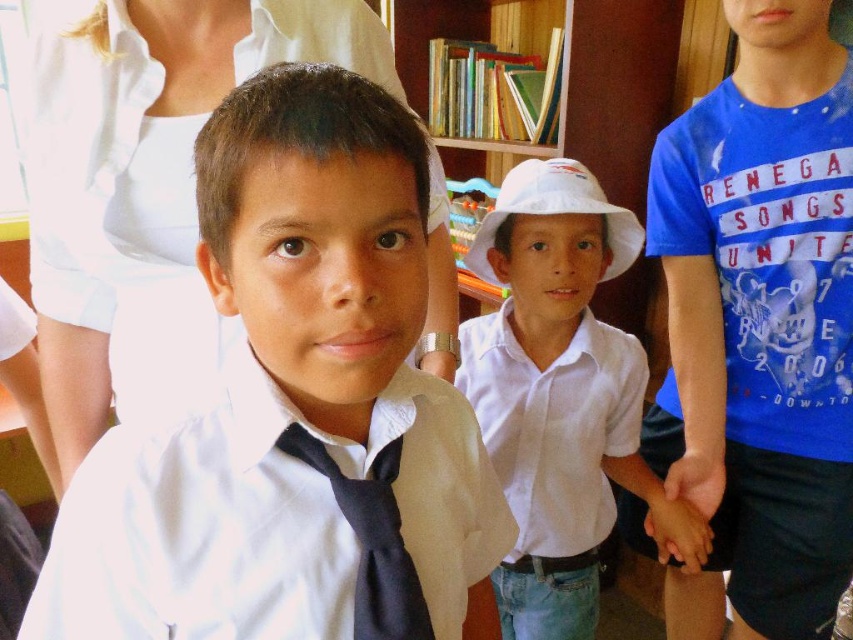
Please describe the position of the white matte shirt at center in terms of coordinates based on the image frame. The image frame is considered as a coordinate system where the bottom left corner is the origin point. The x and y axes increase to the right and upward respectively. The coordinates are normalized between 0 and 1. Please provide the coordinates as a tuple of two decimal numbers rounded to three decimal places. The answer must be in the following format, with no additional text or explanation. 2

The 2D location of white matte shirt at center is at point (293,408). So the coordinates are (293,408).